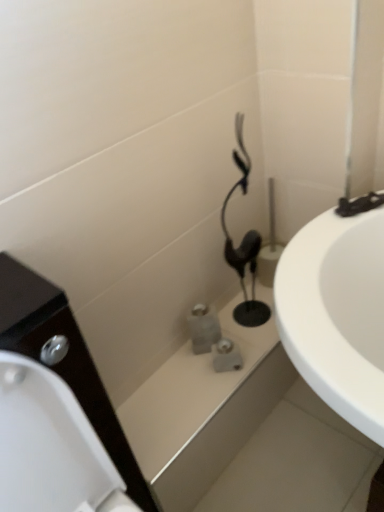
Find the location of a particular element. blank space situated above matte gray stone bath at center, the first bath from the back (from a real-world perspective) is located at coordinates (202, 372).